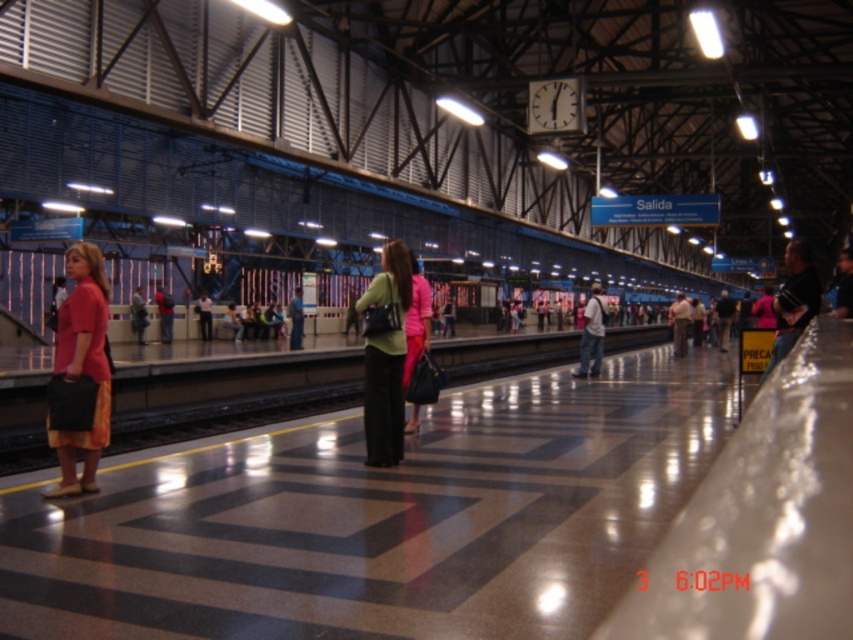
Which is above, matte pink blouse at left or light blue jeans at center?

light blue jeans at center is above.

What do you see at coordinates (74, 468) in the screenshot?
I see `matte pink blouse at left` at bounding box center [74, 468].

Locate an element on the screen. Image resolution: width=853 pixels, height=640 pixels. matte pink blouse at left is located at coordinates (74, 468).

What do you see at coordinates (74, 468) in the screenshot? I see `matte pink blouse at left` at bounding box center [74, 468].

Who is taller, matte pink blouse at left or green fabric handbag at center?

Standing taller between the two is green fabric handbag at center.

Describe the element at coordinates (74, 468) in the screenshot. The height and width of the screenshot is (640, 853). I see `matte pink blouse at left` at that location.

You are a GUI agent. You are given a task and a screenshot of the screen. Output one action in this format:
    pyautogui.click(x=<x>, y=<y>)
    Task: Click on the matte pink blouse at left
    The image size is (853, 640).
    Given the screenshot: What is the action you would take?
    pyautogui.click(x=74, y=468)

Who is taller, matte green sweater at center or matte pink shirt at left?

matte green sweater at center is taller.

Which is more to the left, matte green sweater at center or matte pink shirt at left?

matte pink shirt at left

Is point (370, 442) positioned in front of point (143, 323)?

Yes, point (370, 442) is closer to viewer.

Identify the location of matte green sweater at center. (386, 358).